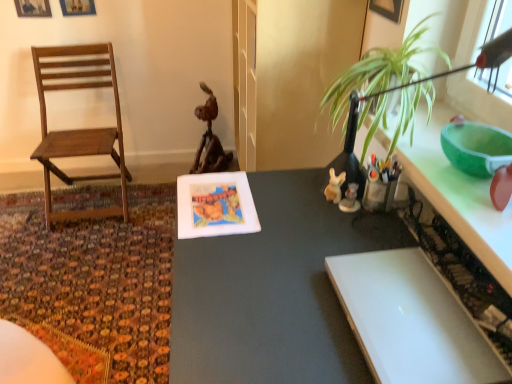
Question: Considering the positions of matte gray table at center and white glossy figurine at center-right, the 1th toy from the right, in the image, is matte gray table at center wider or thinner than white glossy figurine at center-right, the 1th toy from the right,?

Choices:
 (A) thin
 (B) wide

Answer: (B)

Question: From the image's perspective, relative to white glossy figurine at center-right, the 1th toy from the right, is matte gray table at center above or below?

Choices:
 (A) below
 (B) above

Answer: (A)

Question: Estimate the real-world distances between objects in this image. Which object is closer to the wooden chair at left?

Choices:
 (A) rustic wood statue at center
 (B) green glossy counter top at upper right
 (C) white matte rabbit at center-right, which ranks as the 2th toy in right-to-left order
 (D) white glossy figurine at center-right, the 1th toy from the right
 (E) green leafy plant at upper right

Answer: (A)

Question: Considering the real-world distances, which object is farthest from the wooden chair at left?

Choices:
 (A) white glossy figurine at center-right, which is the second toy from left to right
 (B) matte gray table at center
 (C) green leafy plant at upper right
 (D) green glossy counter top at upper right
 (E) white matte rabbit at center-right, which ranks as the 2th toy in right-to-left order

Answer: (A)